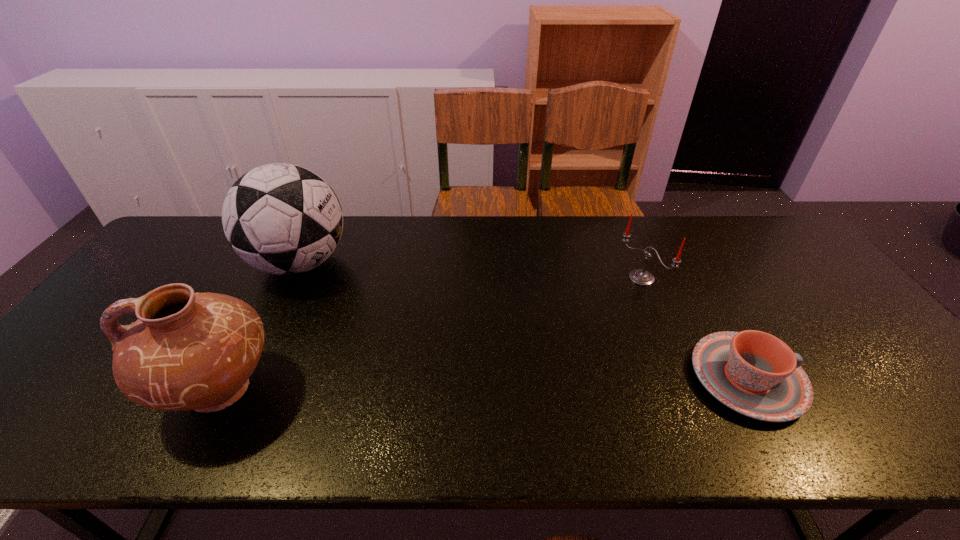
This screenshot has height=540, width=960. Identify the location of blank area at the right edge. (832, 334).

In the image, there is a desktop. Where is `vacant space at the far right corner`? Image resolution: width=960 pixels, height=540 pixels. vacant space at the far right corner is located at coordinates (755, 237).

Locate an element on the screen. This screenshot has width=960, height=540. free space at the near right corner is located at coordinates (874, 388).

You are a GUI agent. You are given a task and a screenshot of the screen. Output one action in this format:
    pyautogui.click(x=<x>, y=<y>)
    Task: Click on the vacant space that's between the pottery and the shortest object
    This screenshot has height=540, width=960.
    Given the screenshot: What is the action you would take?
    pyautogui.click(x=483, y=384)

Locate an element on the screen. The height and width of the screenshot is (540, 960). free area in between the shortest object and the second shortest object is located at coordinates (694, 328).

At what (x,y) coordinates should I click in order to perform the action: click on empty space between the soccer ball and the chinaware. Please return your answer as a coordinate pair (x, y). Looking at the image, I should click on (523, 321).

Locate an element on the screen. The image size is (960, 540). blank region between the candle and the soccer ball is located at coordinates (x=470, y=271).

Where is `vacant area that lies between the pottery and the shortest object`? This screenshot has width=960, height=540. vacant area that lies between the pottery and the shortest object is located at coordinates (483, 384).

Find the location of a particular element. This screenshot has width=960, height=540. free space between the chinaware and the candle is located at coordinates (694, 328).

I want to click on vacant area that lies between the third tallest object and the shortest object, so click(x=694, y=328).